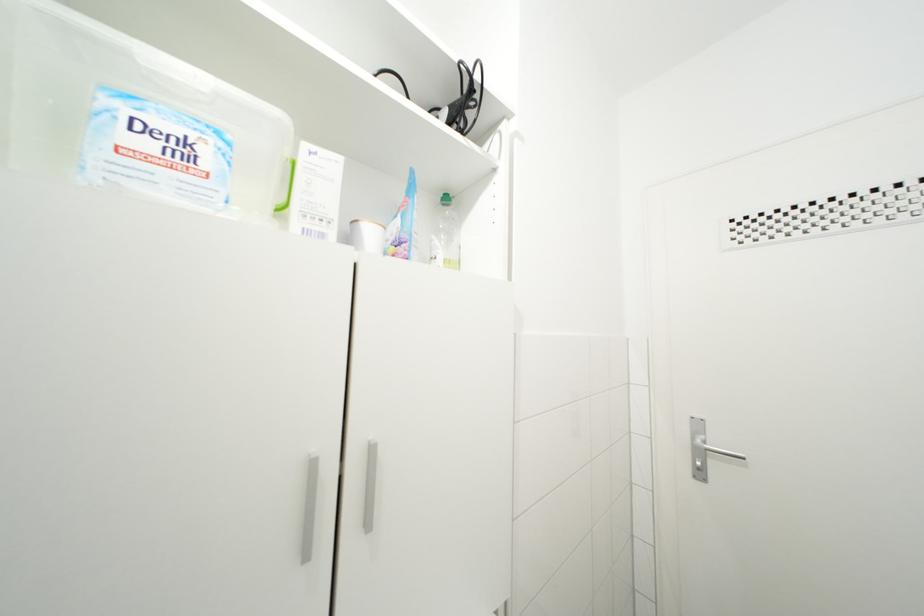
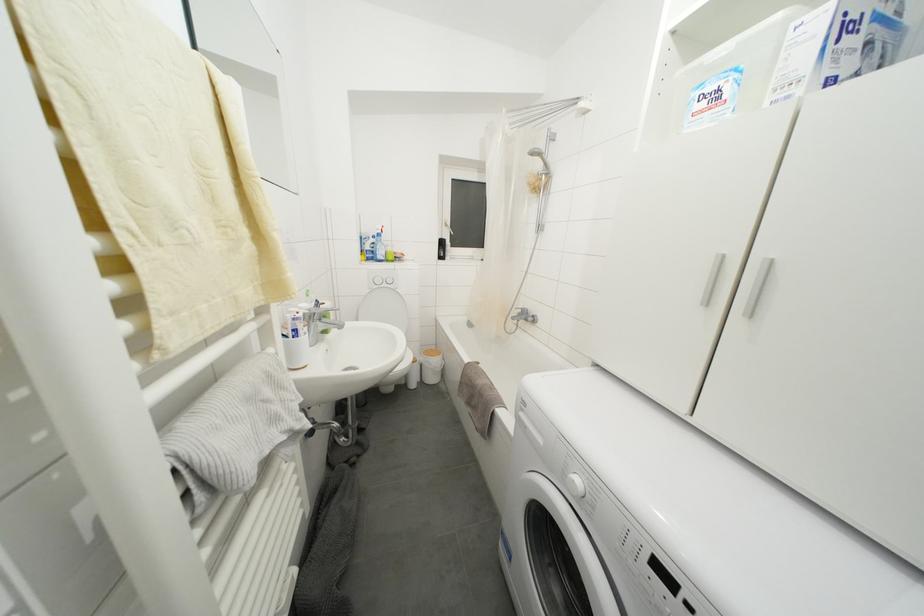
Question: The images are taken continuously from a first-person perspective. In which direction is your viewpoint rotating?

Choices:
 (A) Left
 (B) Right
 (C) Up
 (D) Down

Answer: (A)